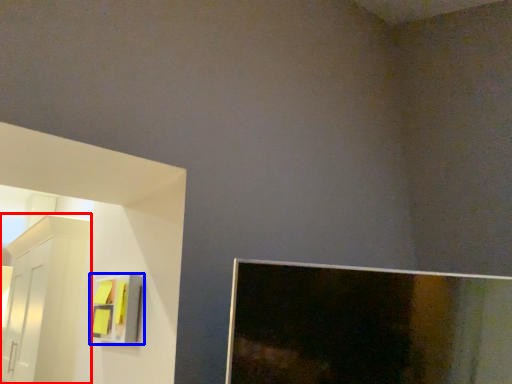
Question: Which of the following is the closest to the observer, furniture (highlighted by a red box) or cabinet (highlighted by a blue box)?

Choices:
 (A) furniture
 (B) cabinet

Answer: (B)